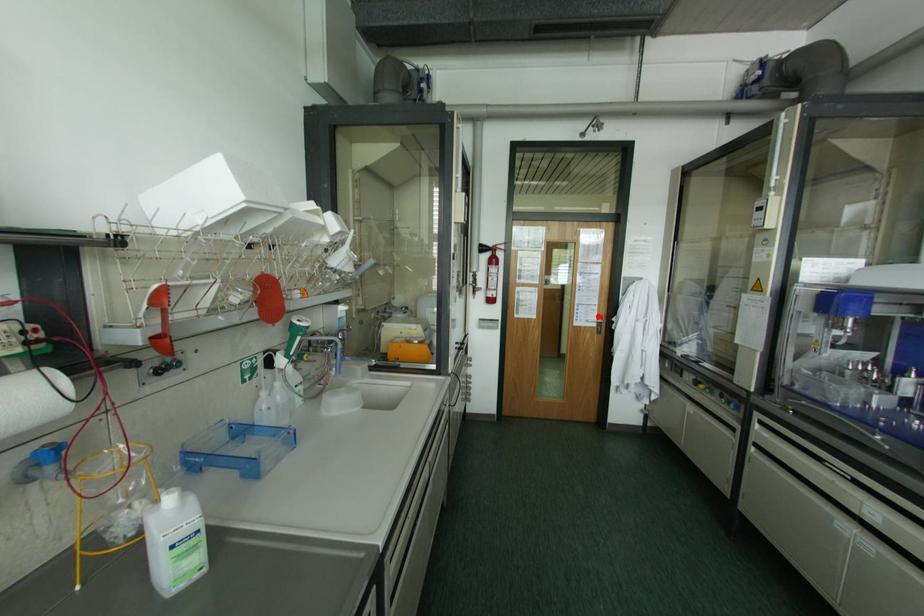
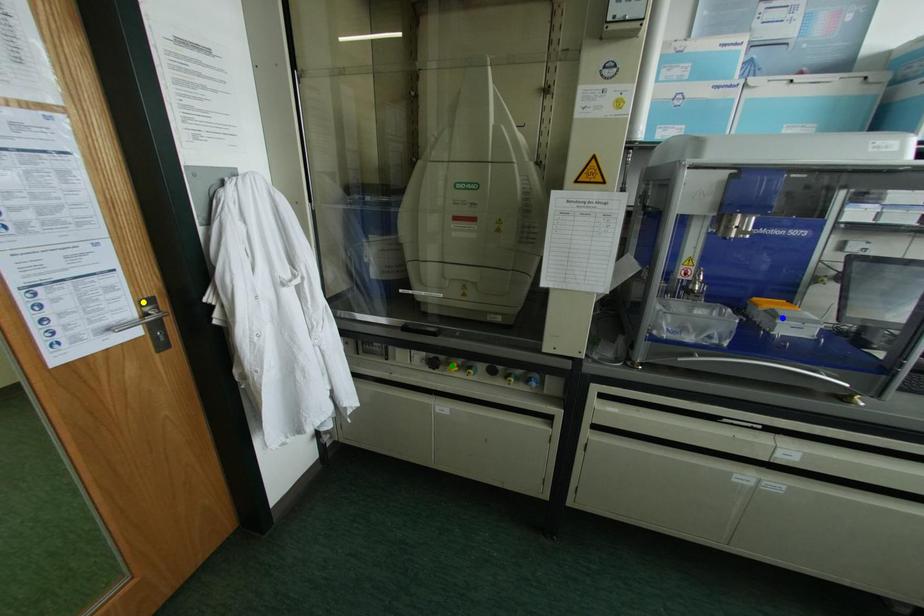
Question: I am providing you with two images of the same scene from different viewpoints. A red point is marked on the first image. You are given multiple points on the second image. Which point in image 2 represents the same 3d spot as the red point in image 1?

Choices:
 (A) yellow point
 (B) green point
 (C) blue point

Answer: (A)